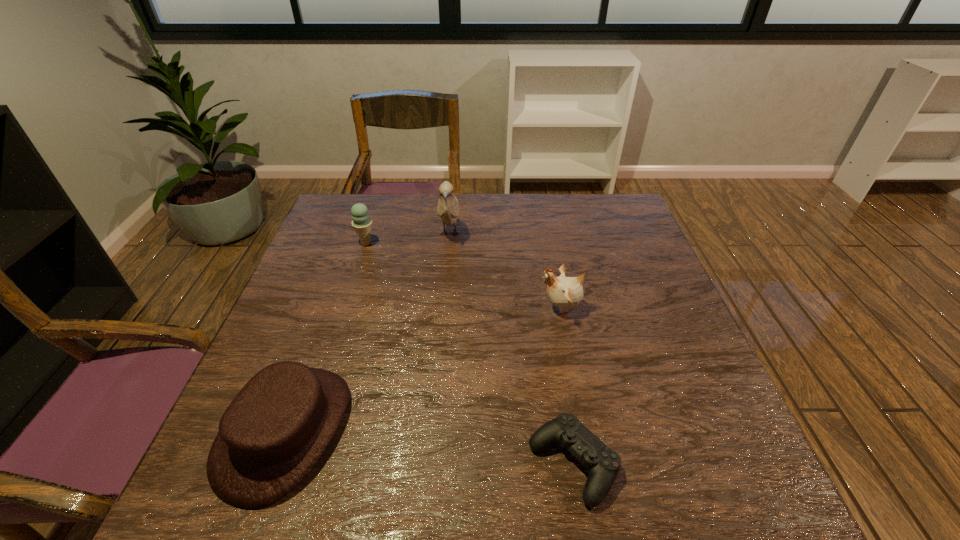
In the image, there is a desktop. At what (x,y) coordinates should I click in order to perform the action: click on free space at the far edge. Please return your answer as a coordinate pair (x, y). This screenshot has width=960, height=540. Looking at the image, I should click on (462, 224).

Where is `free space at the near edge of the desktop`? The width and height of the screenshot is (960, 540). free space at the near edge of the desktop is located at coordinates (443, 467).

In order to click on vacant region at the left edge of the desktop in this screenshot , I will do `click(345, 238)`.

What are the coordinates of `vacant space at the right edge of the desktop` in the screenshot? It's located at (628, 279).

This screenshot has height=540, width=960. In order to click on free region at the far left corner of the desktop in this screenshot , I will do point(332,223).

In the image, there is a desktop. In order to click on vacant region at the far right corner in this screenshot , I will do `click(633, 234)`.

Locate an element on the screen. This screenshot has height=540, width=960. vacant area between the shortest object and the ice cream is located at coordinates (469, 354).

Identify the location of free space between the ice cream and the fourth tallest object. (325, 337).

You are a GUI agent. You are given a task and a screenshot of the screen. Output one action in this format:
    pyautogui.click(x=<x>, y=<y>)
    Task: Click on the free point between the shortest object and the shorter bird
    
    Given the screenshot: What is the action you would take?
    pyautogui.click(x=567, y=386)

The image size is (960, 540). Find the location of `free point between the third farthest object and the shortest object`. free point between the third farthest object and the shortest object is located at coordinates (567, 386).